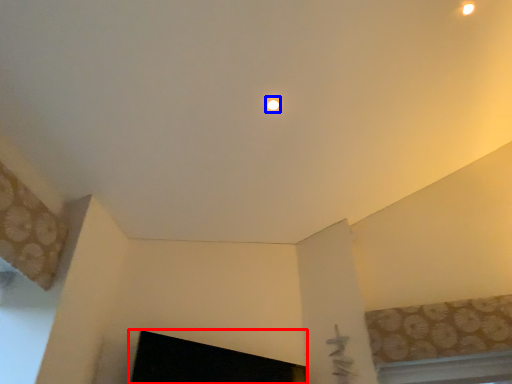
Question: Which object is closer to the camera taking this photo, fireplace (highlighted by a red box) or lighting (highlighted by a blue box)?

Choices:
 (A) fireplace
 (B) lighting

Answer: (A)